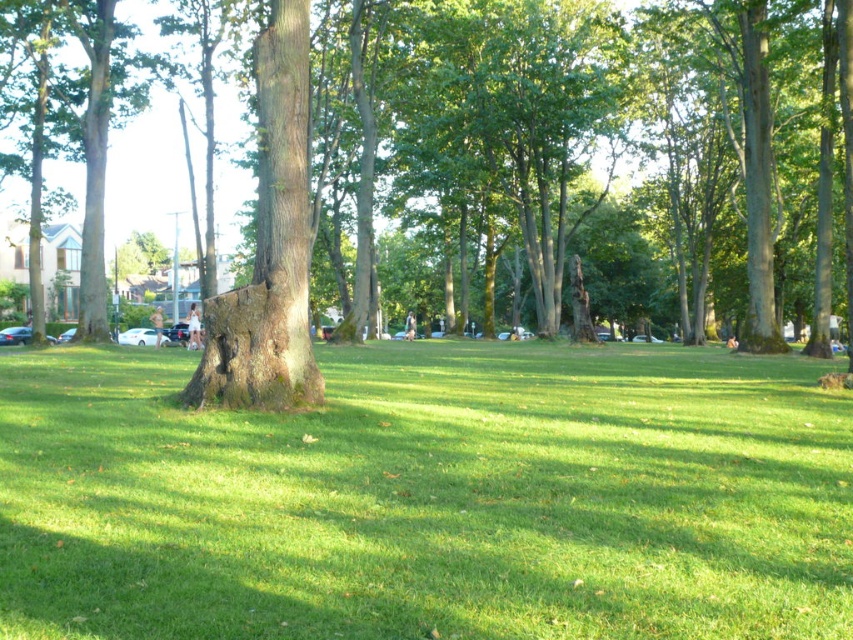
You are a gardener trying to mow the lawn. You notice the green grassy at center and the smooth brown tree trunk at center. Which one is shorter?

The green grassy at center is shorter than the smooth brown tree trunk at center.

You are standing at the edge of the park and see the green grassy at center and the smooth brown tree trunk at center. Which object is positioned to the right side from your viewpoint?

The green grassy at center is to the right of the smooth brown tree trunk at center, so the green grassy at center is positioned to the right side from your viewpoint.

You are a gardener who wants to plant a new flower bed in the park. You have a small flower pot that needs to be placed on the green grassy at center or the smooth brown tree trunk at center. Which surface can accommodate the flower pot without it being too small?

The green grassy at center has a larger size compared to the smooth brown tree trunk at center, so the flower pot can be placed on the green grassy at center as it has more space.